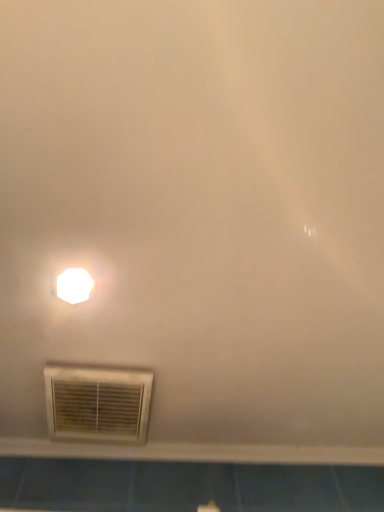
Question: Would you say white plastic air conditioning at lower left is part of white glossy light fixture at upper left's contents?

Choices:
 (A) no
 (B) yes

Answer: (A)

Question: Considering the relative sizes of white glossy light fixture at upper left and white plastic air conditioning at lower left in the image provided, is white glossy light fixture at upper left wider than white plastic air conditioning at lower left?

Choices:
 (A) no
 (B) yes

Answer: (A)

Question: Is white glossy light fixture at upper left to the left of white plastic air conditioning at lower left from the viewer's perspective?

Choices:
 (A) yes
 (B) no

Answer: (A)

Question: Can you confirm if white glossy light fixture at upper left is taller than white plastic air conditioning at lower left?

Choices:
 (A) no
 (B) yes

Answer: (A)

Question: Is white glossy light fixture at upper left smaller than white plastic air conditioning at lower left?

Choices:
 (A) no
 (B) yes

Answer: (B)

Question: From a real-world perspective, is white plastic air conditioning at lower left physically located above or below white plastic window sill at lower center?

Choices:
 (A) above
 (B) below

Answer: (B)

Question: Relative to white plastic window sill at lower center, is white plastic air conditioning at lower left in front or behind?

Choices:
 (A) behind
 (B) front

Answer: (B)

Question: Considering the positions of white plastic air conditioning at lower left and white plastic window sill at lower center in the image, is white plastic air conditioning at lower left taller or shorter than white plastic window sill at lower center?

Choices:
 (A) short
 (B) tall

Answer: (A)

Question: Is point (82, 367) positioned closer to the camera than point (254, 459)?

Choices:
 (A) farther
 (B) closer

Answer: (B)

Question: From the image's perspective, is white plastic window sill at lower center positioned above or below white plastic air conditioning at lower left?

Choices:
 (A) above
 (B) below

Answer: (B)

Question: Relative to white plastic air conditioning at lower left, is white plastic window sill at lower center in front or behind?

Choices:
 (A) behind
 (B) front

Answer: (A)

Question: Would you say white plastic window sill at lower center is to the left or to the right of white plastic air conditioning at lower left in the picture?

Choices:
 (A) left
 (B) right

Answer: (B)

Question: Based on their sizes in the image, would you say white plastic window sill at lower center is bigger or smaller than white plastic air conditioning at lower left?

Choices:
 (A) big
 (B) small

Answer: (B)

Question: Choose the correct answer: Is white plastic window sill at lower center inside white glossy light fixture at upper left or outside it?

Choices:
 (A) inside
 (B) outside

Answer: (B)

Question: From the image's perspective, is white plastic window sill at lower center located above or below white glossy light fixture at upper left?

Choices:
 (A) above
 (B) below

Answer: (B)